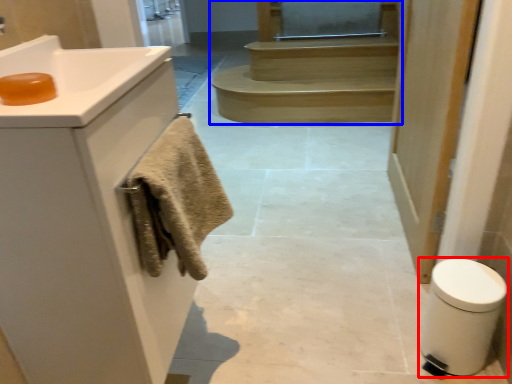
Question: Among these objects, which one is farthest to the camera, bidet (highlighted by a red box) or stairs (highlighted by a blue box)?

Choices:
 (A) bidet
 (B) stairs

Answer: (B)